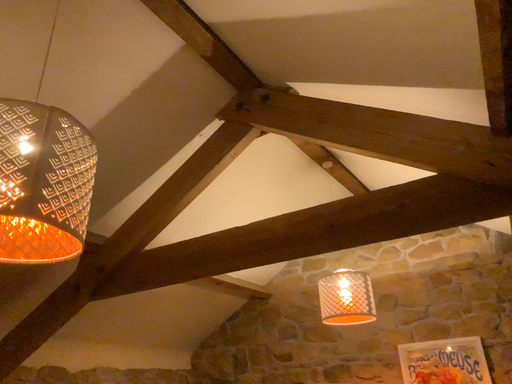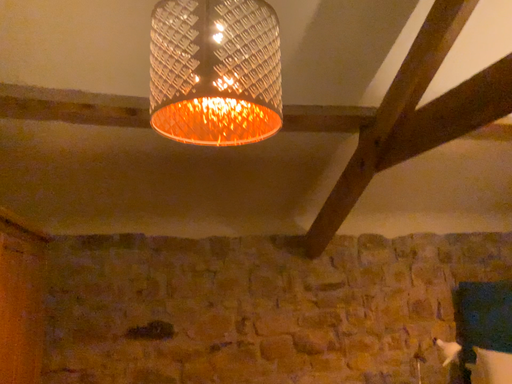
Question: Which way did the camera rotate in the video?

Choices:
 (A) rotated downward
 (B) rotated upward

Answer: (A)